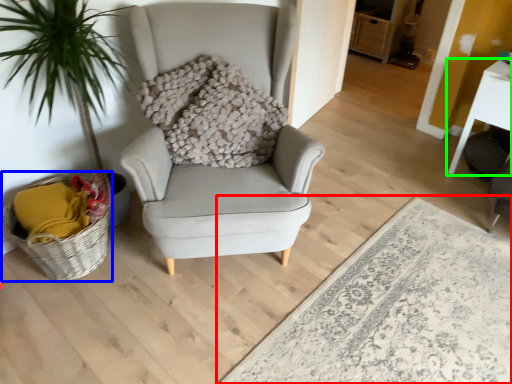
Question: Estimate the real-world distances between objects in this image. Which object is farther from plain (highlighted by a red box), basket (highlighted by a blue box) or table (highlighted by a green box)?

Choices:
 (A) basket
 (B) table

Answer: (A)